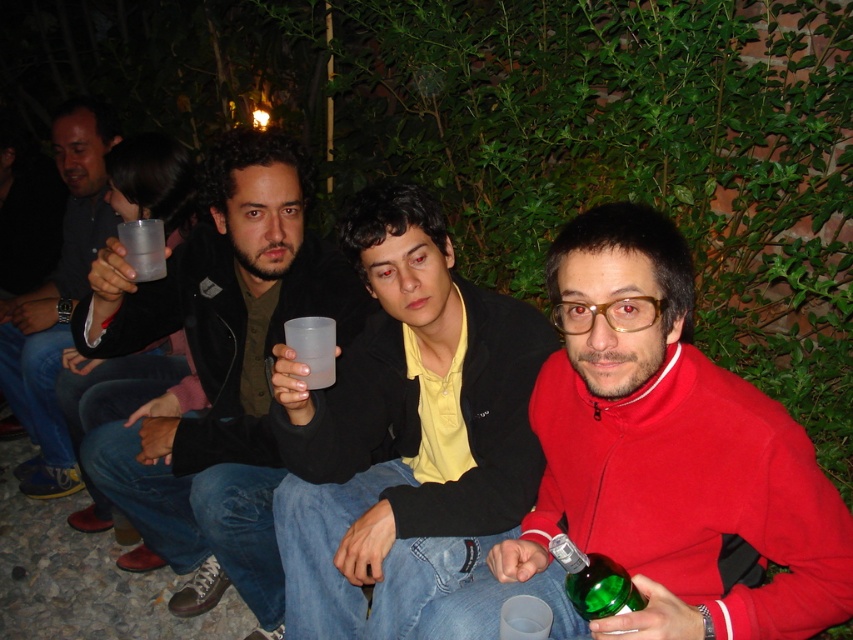
Question: Which point is closer to the camera?

Choices:
 (A) matte black jacket at upper left
 (B) transparent plastic cup at center
 (C) matte plastic cup at center

Answer: (C)

Question: Is transparent plastic cup at center bigger than transparent plastic cup at upper left?

Choices:
 (A) yes
 (B) no

Answer: (B)

Question: Among these points, which one is nearest to the camera?

Choices:
 (A) (561, 540)
 (B) (312, 342)

Answer: (A)

Question: Does matte black jacket at upper left appear on the right side of green glass bottle at lower right?

Choices:
 (A) yes
 (B) no

Answer: (B)

Question: Which object appears closest to the camera in this image?

Choices:
 (A) green glass bottle at lower right
 (B) matte plastic cup at center

Answer: (A)

Question: Is matte black jacket at center positioned in front of transparent plastic cup at upper left?

Choices:
 (A) yes
 (B) no

Answer: (A)